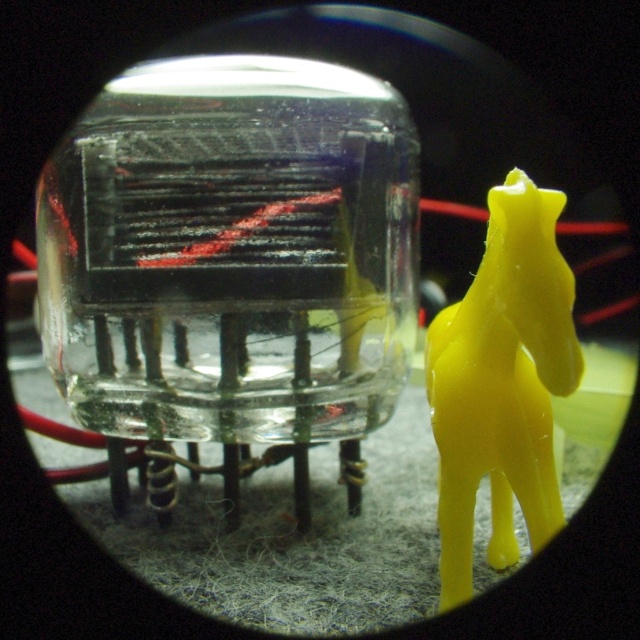
You are trying to place both the transparent glass tube at center and the yellow matte plastic horse at right into a storage box. The box can only fit items that are smaller than the tube. Which item will not fit into the box?

The transparent glass tube at center is larger in size than the yellow matte plastic horse at right, so the transparent glass tube at center will not fit into the box.